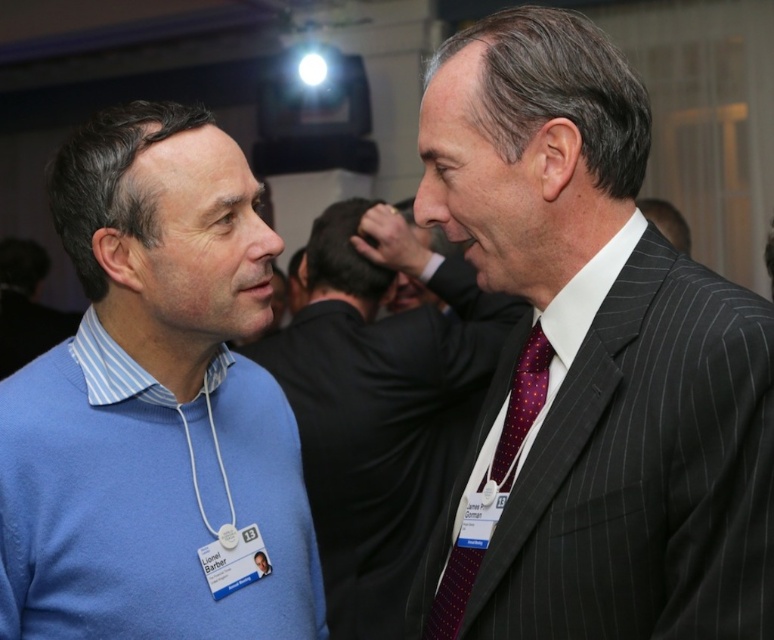
You are standing at the origin point in the image. Which of the two points, point (721, 369) or point (354, 212), is closer to you?

Point (721, 369) is closer to you because it is in front of point (354, 212).

Consider the image. You are a photographer at a formal event. You need to capture a clear photo of both the dark gray pinstripe suit at center and the matte black suit at center. Since the two are standing close to each other, which one should you focus on first to ensure both are in focus?

The dark gray pinstripe suit at center is in front of the matte black suit at center, so you should focus on the dark gray pinstripe suit at center first to ensure both are in focus.

You are standing in front of the two people in the image. Which of the two points, point [687,305] or point [279,532], is closer to you?

Point [687,305] is closer to the viewer than point [279,532].